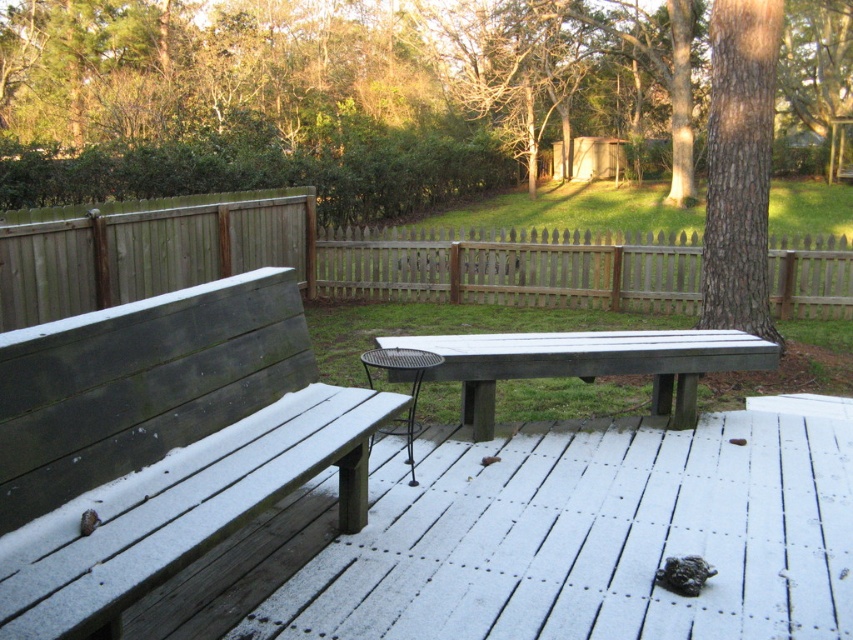
Question: Is wooden bench at left to the left of weathered wood fence at center from the viewer's perspective?

Choices:
 (A) yes
 (B) no

Answer: (A)

Question: Estimate the real-world distances between objects in this image. Which object is closer to the wooden picket fence at center?

Choices:
 (A) wooden bench at left
 (B) weathered wood fence at center
 (C) white wood deck at center
 (D) matte gray picnic table at center

Answer: (B)

Question: Among these objects, which one is nearest to the camera?

Choices:
 (A) white wood deck at center
 (B) weathered wood fence at center
 (C) wooden bench at left

Answer: (C)

Question: Which point is farther to the camera?

Choices:
 (A) brown rough bark tree at right
 (B) wooden picket fence at center
 (C) white wood deck at center
 (D) weathered wood fence at center

Answer: (B)

Question: Is wooden bench at left closer to the viewer compared to brown rough bark tree at right?

Choices:
 (A) yes
 (B) no

Answer: (A)

Question: Does weathered wood fence at center have a greater width compared to wooden picket fence at center?

Choices:
 (A) no
 (B) yes

Answer: (B)